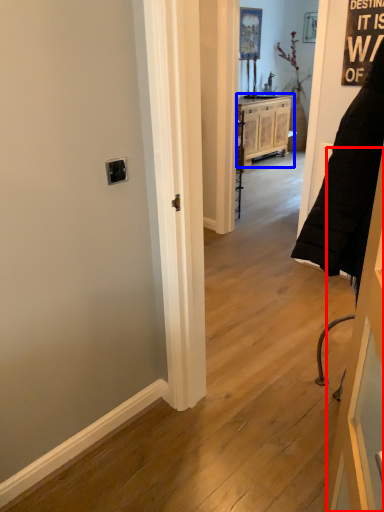
Question: Which of the following is the farthest to the observer, door (highlighted by a red box) or cabinetry (highlighted by a blue box)?

Choices:
 (A) door
 (B) cabinetry

Answer: (B)